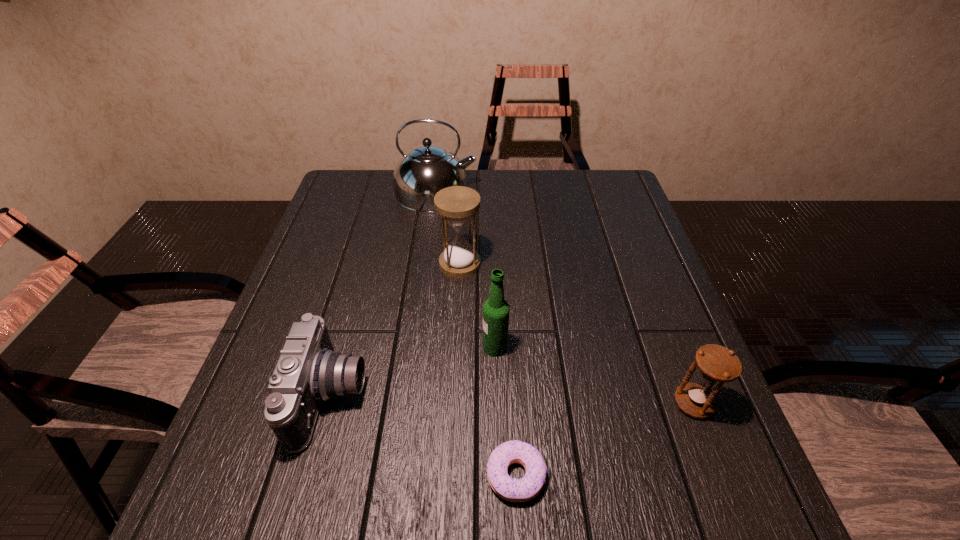
In the image, there is a desktop. Where is `free region at the far edge`? free region at the far edge is located at coordinates (486, 181).

In the image, there is a desktop. Where is `blank space at the near edge`? The image size is (960, 540). blank space at the near edge is located at coordinates (528, 505).

Find the location of a particular element. This screenshot has width=960, height=540. vacant region at the left edge of the desktop is located at coordinates (292, 285).

At what (x,y) coordinates should I click in order to perform the action: click on free space at the right edge of the desktop. Please return your answer as a coordinate pair (x, y). Looking at the image, I should click on (623, 308).

Find the location of a particular element. vacant space at the far left corner is located at coordinates (349, 191).

At what (x,y) coordinates should I click in order to perform the action: click on vacant area at the near left corner. Please return your answer as a coordinate pair (x, y). The height and width of the screenshot is (540, 960). Looking at the image, I should click on (232, 491).

Locate an element on the screen. The width and height of the screenshot is (960, 540). vacant space at the far right corner is located at coordinates (591, 183).

At what (x,y) coordinates should I click in order to perform the action: click on free space that is in between the left hourglass and the doughnut. Please return your answer as a coordinate pair (x, y). Looking at the image, I should click on (488, 369).

Where is `vacant area between the nearer hourglass and the taller hourglass`? Image resolution: width=960 pixels, height=540 pixels. vacant area between the nearer hourglass and the taller hourglass is located at coordinates (577, 334).

Find the location of a particular element. blank region between the camera and the doughnut is located at coordinates (423, 436).